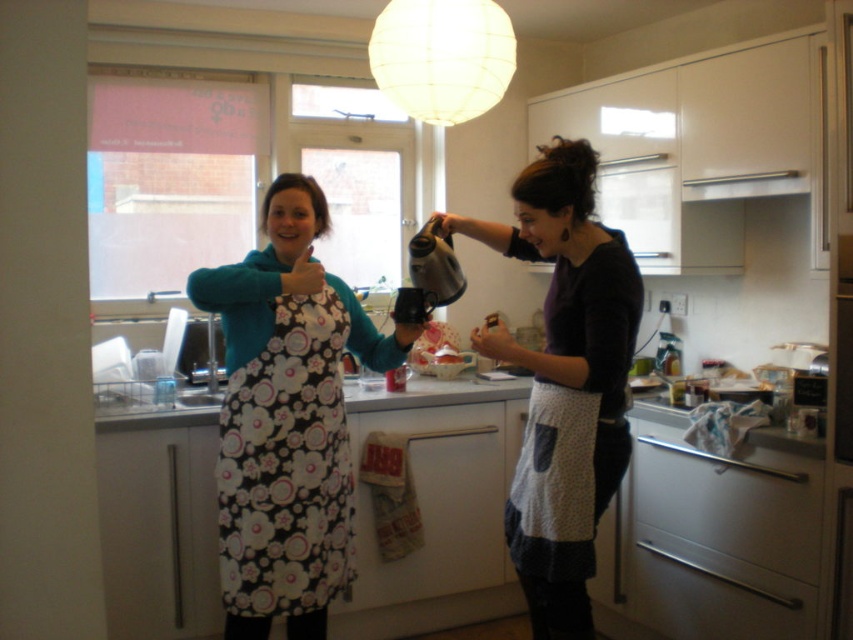
Which is in front, point (271, 419) or point (780, 193)?

Point (271, 419) is more forward.

Which is more to the left, floral fabric apron at center or white glossy exhaust hood at upper center?

Positioned to the left is floral fabric apron at center.

Which is in front, point (328, 225) or point (724, 196)?

Point (328, 225) is more forward.

Image resolution: width=853 pixels, height=640 pixels. Identify the location of floral fabric apron at center. (287, 419).

Is white dotted apron at lower center to the right of white glossy exhaust hood at upper center from the viewer's perspective?

Incorrect, white dotted apron at lower center is not on the right side of white glossy exhaust hood at upper center.

Can you confirm if white dotted apron at lower center is bigger than white glossy exhaust hood at upper center?

Correct, white dotted apron at lower center is larger in size than white glossy exhaust hood at upper center.

Image resolution: width=853 pixels, height=640 pixels. I want to click on white dotted apron at lower center, so click(x=554, y=486).

Is white dotted apron at center below white glossy exhaust hood at upper center?

Yes, white dotted apron at center is below white glossy exhaust hood at upper center.

Which is above, white dotted apron at center or white glossy exhaust hood at upper center?

white glossy exhaust hood at upper center

You are a GUI agent. You are given a task and a screenshot of the screen. Output one action in this format:
    pyautogui.click(x=<x>, y=<y>)
    Task: Click on the white dotted apron at center
    The height and width of the screenshot is (640, 853).
    Given the screenshot: What is the action you would take?
    pyautogui.click(x=566, y=369)